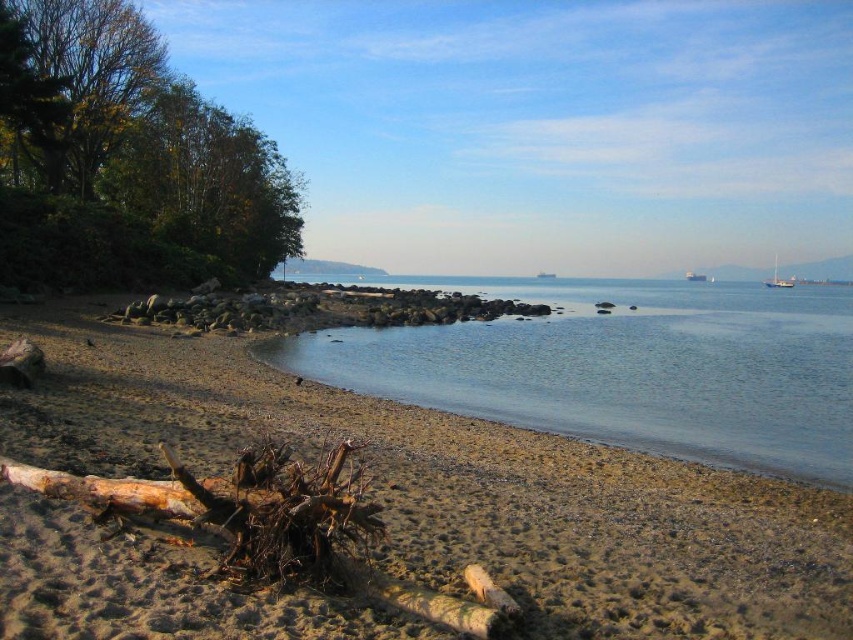
Question: Which object is positioned farthest from the white glossy sailboat at upper right?

Choices:
 (A) brown sandy beach at lower left
 (B) clear water at center

Answer: (A)

Question: Is brown sandy beach at lower left smaller than clear water at center?

Choices:
 (A) yes
 (B) no

Answer: (A)

Question: Which object is closer to the camera taking this photo?

Choices:
 (A) brown sandy beach at lower left
 (B) clear water at center
 (C) white glossy sailboat at upper right

Answer: (A)

Question: Which point appears closest to the camera in this image?

Choices:
 (A) (311, 630)
 (B) (769, 288)

Answer: (A)

Question: Is clear water at center behind white glossy sailboat at upper right?

Choices:
 (A) no
 (B) yes

Answer: (A)

Question: Does brown sandy beach at lower left have a lesser width compared to clear water at center?

Choices:
 (A) yes
 (B) no

Answer: (A)